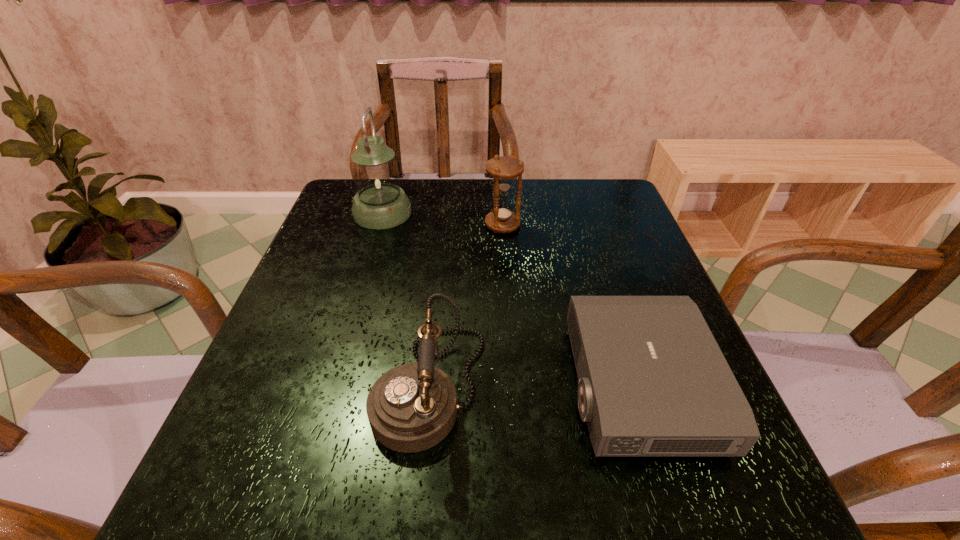
Where is `the tallest object`? The image size is (960, 540). the tallest object is located at coordinates (380, 203).

In order to click on the leftmost object in this screenshot , I will do `click(380, 203)`.

This screenshot has width=960, height=540. I want to click on hourglass, so coord(504,169).

Image resolution: width=960 pixels, height=540 pixels. Find the location of `the second tallest object`. the second tallest object is located at coordinates (504, 169).

Image resolution: width=960 pixels, height=540 pixels. I want to click on the third tallest object, so click(x=412, y=407).

At what (x,y) coordinates should I click in order to perform the action: click on the second object from left to right. Please return your answer as a coordinate pair (x, y). Image resolution: width=960 pixels, height=540 pixels. Looking at the image, I should click on (412, 407).

Where is `the shortest object`? the shortest object is located at coordinates (653, 381).

You are a GUI agent. You are given a task and a screenshot of the screen. Output one action in this format:
    pyautogui.click(x=<x>, y=<y>)
    Task: Click on the projector
    The height and width of the screenshot is (540, 960).
    Given the screenshot: What is the action you would take?
    pyautogui.click(x=653, y=381)

Locate an element on the screen. This screenshot has width=960, height=540. free location located on the right of the tallest object is located at coordinates (478, 213).

The height and width of the screenshot is (540, 960). Identify the location of vacant point located 0.270m on the left of the hourglass. (381, 225).